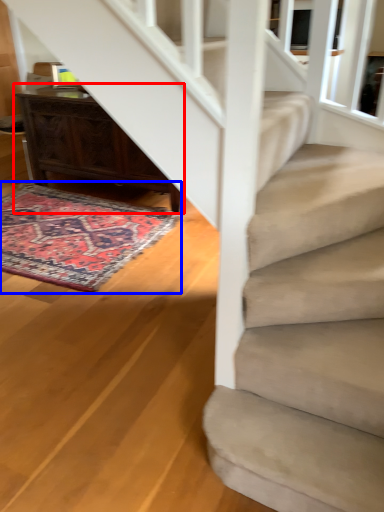
Question: Among these objects, which one is farthest to the camera, desk (highlighted by a red box) or mat (highlighted by a blue box)?

Choices:
 (A) desk
 (B) mat

Answer: (A)